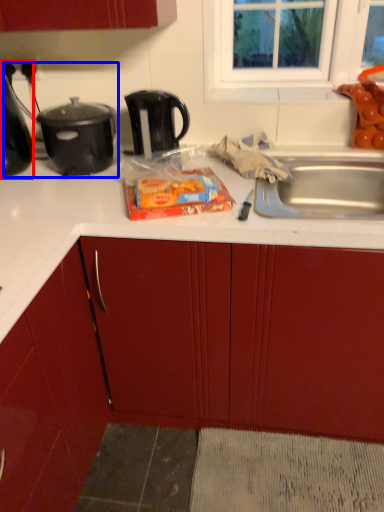
Question: Which object appears farthest to the camera in this image, kitchen appliance (highlighted by a red box) or appliance (highlighted by a blue box)?

Choices:
 (A) kitchen appliance
 (B) appliance

Answer: (B)